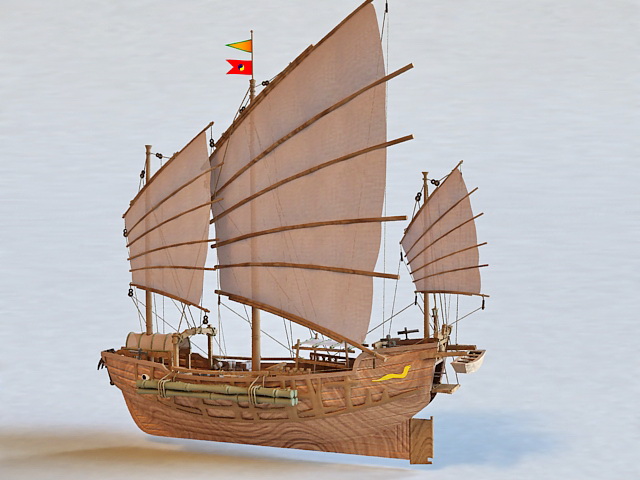
Identify the location of artwork. The height and width of the screenshot is (480, 640). (365, 427).